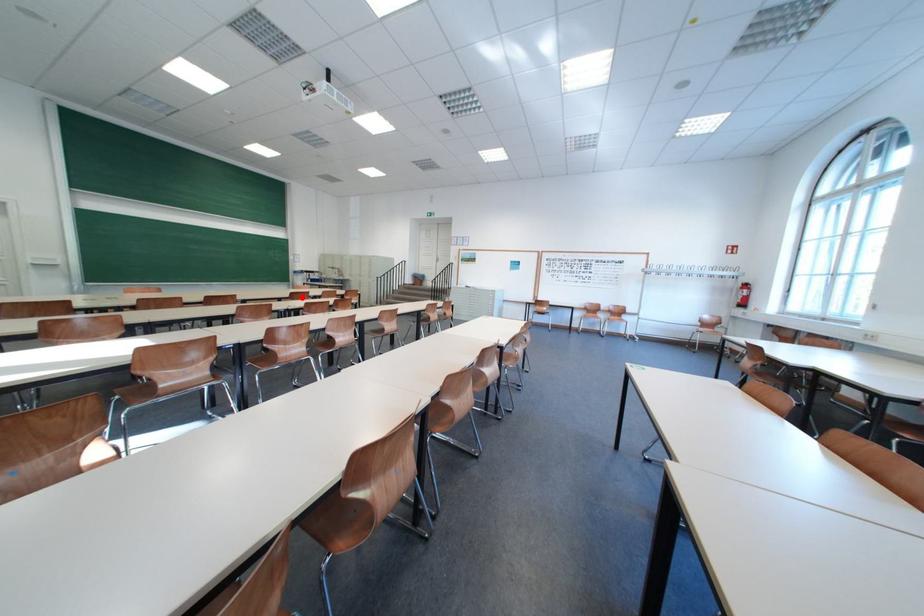
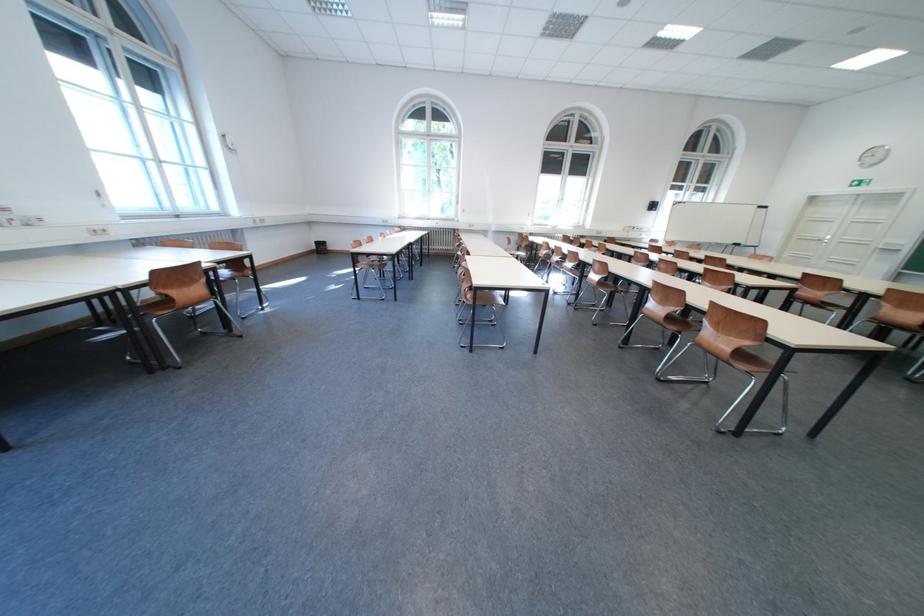
Locate, in the second image, the point that corresponds to the highlighted location in the first image.

(813, 278)